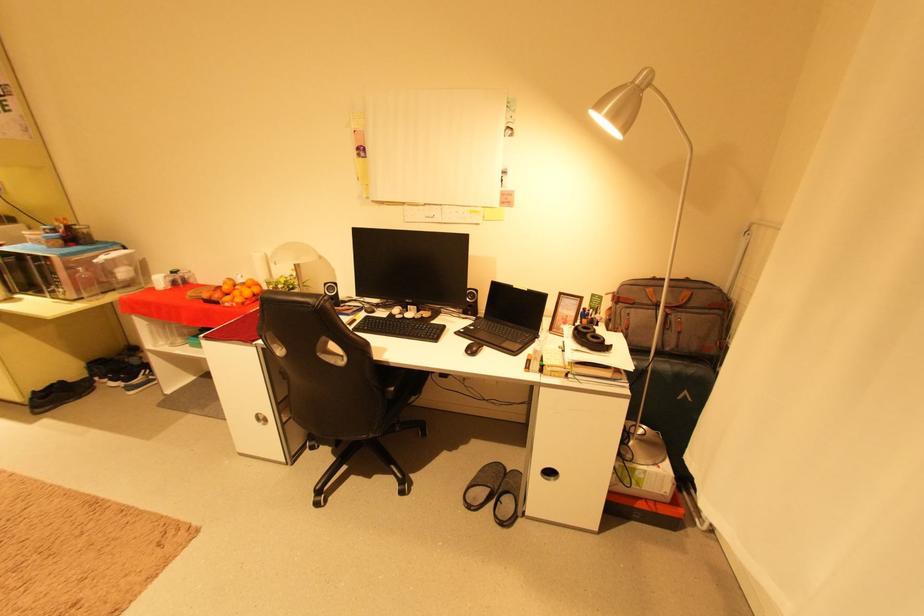
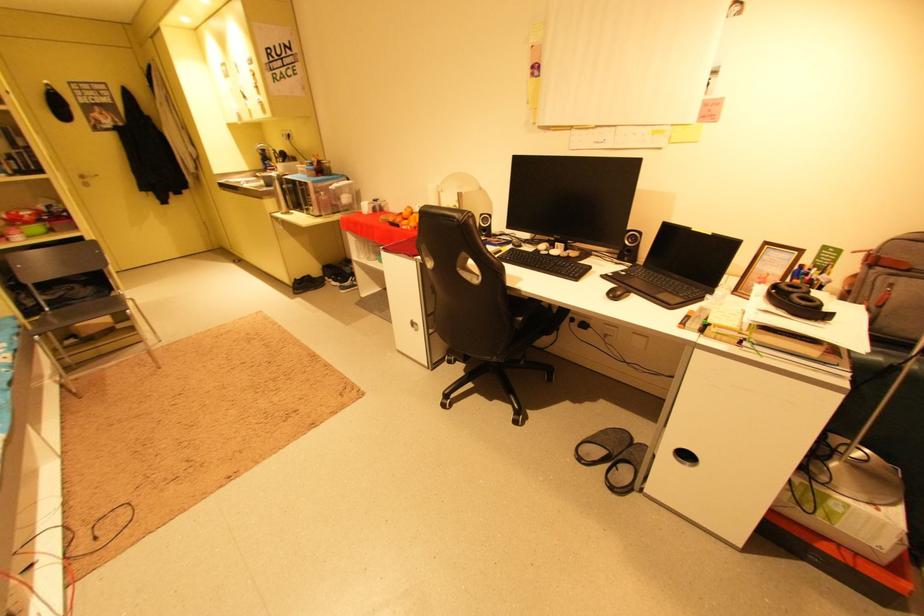
Find the pixel in the second image that matches point 399,390 in the first image.

(529, 320)